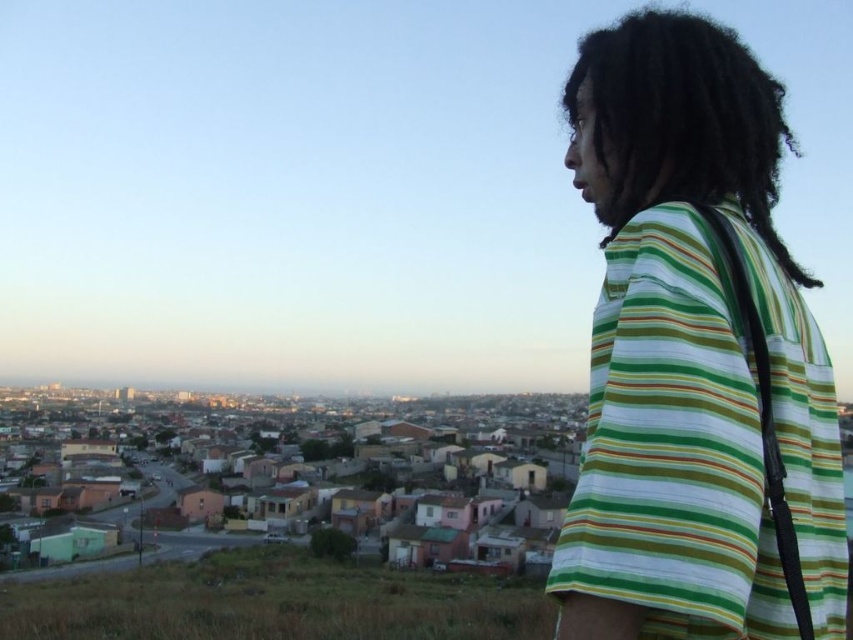
Who is lower down, green striped shirt at right or black curly hair at upper right?

green striped shirt at right is below.

Does green striped shirt at right have a greater width compared to black curly hair at upper right?

Correct, the width of green striped shirt at right exceeds that of black curly hair at upper right.

The height and width of the screenshot is (640, 853). I want to click on green striped shirt at right, so click(x=695, y=356).